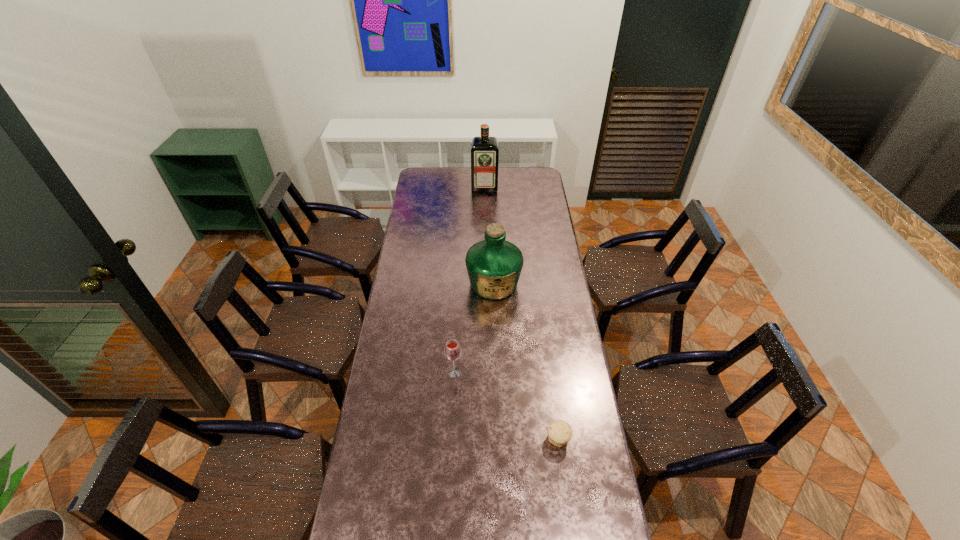
At what (x,y) coordinates should I click in order to perform the action: click on the tallest object. Please return your answer as a coordinate pair (x, y). Looking at the image, I should click on (484, 150).

This screenshot has width=960, height=540. Identify the location of the taller liquor. (484, 150).

Find the location of `the nearer liquor`. the nearer liquor is located at coordinates (494, 265).

Image resolution: width=960 pixels, height=540 pixels. I want to click on the shorter liquor, so click(494, 265).

This screenshot has width=960, height=540. What are the coordinates of `the leftmost object` in the screenshot? It's located at (452, 351).

Identify the location of wineglass. This screenshot has height=540, width=960. click(x=452, y=351).

Find the location of a particular element. Image resolution: width=960 pixels, height=540 pixels. the nearest object is located at coordinates (559, 432).

The height and width of the screenshot is (540, 960). I want to click on muffin, so click(x=559, y=432).

Identify the location of vacant space located 0.190m on the front label of the taller liquor. (485, 211).

Locate an element on the screen. blank space located 0.270m on the label side of the shorter liquor is located at coordinates (495, 352).